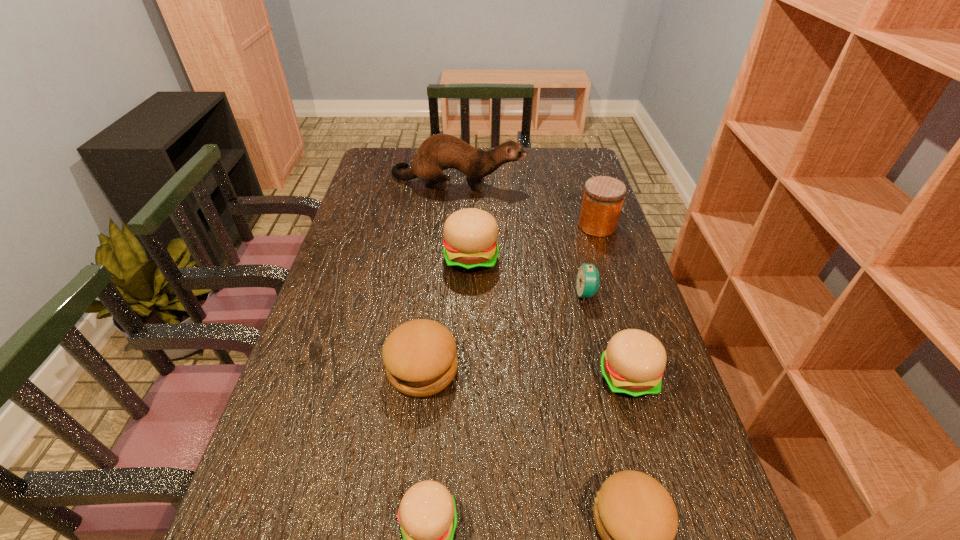
The height and width of the screenshot is (540, 960). I want to click on free space between the biggest beige hamburger and the rightmost beige hamburger, so click(549, 317).

Image resolution: width=960 pixels, height=540 pixels. I want to click on free spot between the farthest beige hamburger and the alarm clock, so click(x=529, y=275).

Identify the location of vacant point located between the jar and the farther brown hamburger. The image size is (960, 540). (510, 297).

Identify the location of vacant area that lies between the second nearest beige hamburger and the farthest object. (542, 278).

I want to click on free space between the farthest object and the left brown hamburger, so click(440, 274).

The height and width of the screenshot is (540, 960). I want to click on object that is the third closest to the second biggest beige hamburger, so click(x=420, y=357).

I want to click on object that is the closest to the smaller brown hamburger, so click(x=632, y=365).

This screenshot has height=540, width=960. What are the coordinates of `the fourth closest hamburger to the bigger brown hamburger` in the screenshot? It's located at (632, 365).

Locate an element on the screen. hamburger that stands as the closest to the orange jar is located at coordinates (470, 243).

Identify which beige hamburger is the second closest to the farthest hamburger. Please provide its 2D coordinates. Your answer should be formatted as a tuple, i.e. [(x, y)], where the tuple contains the x and y coordinates of a point satisfying the conditions above.

[(427, 515)]